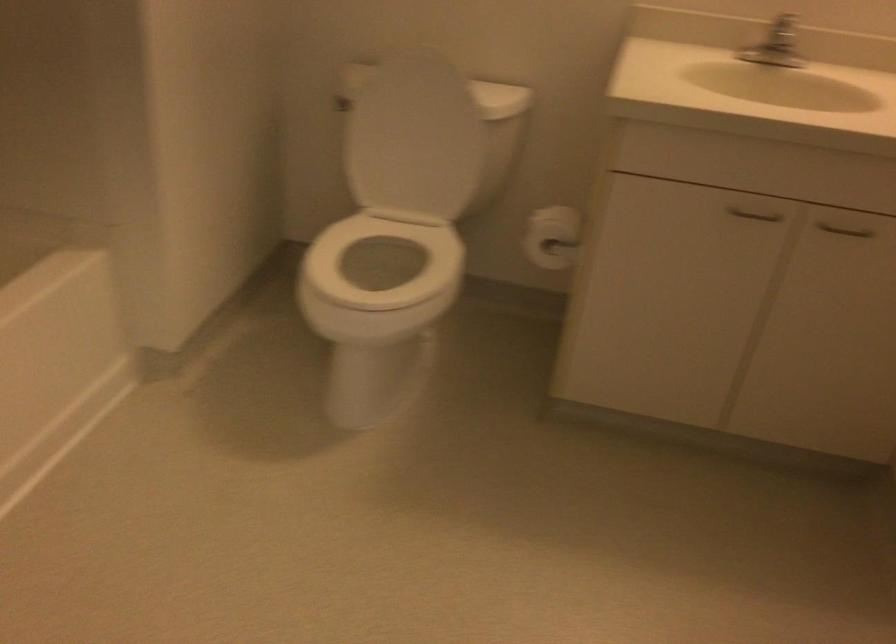
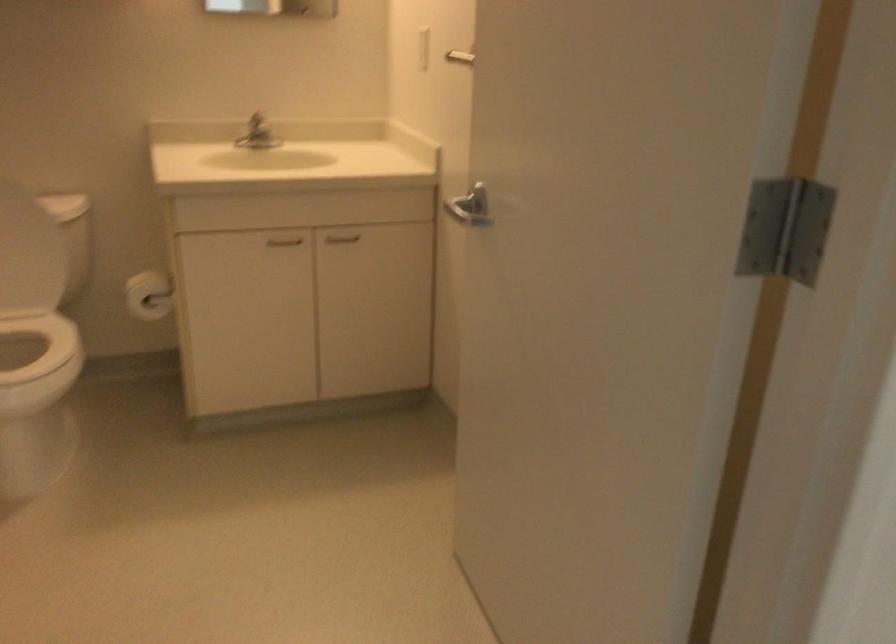
In the second image, find the point that corresponds to the point at 438,104 in the first image.

(12, 210)